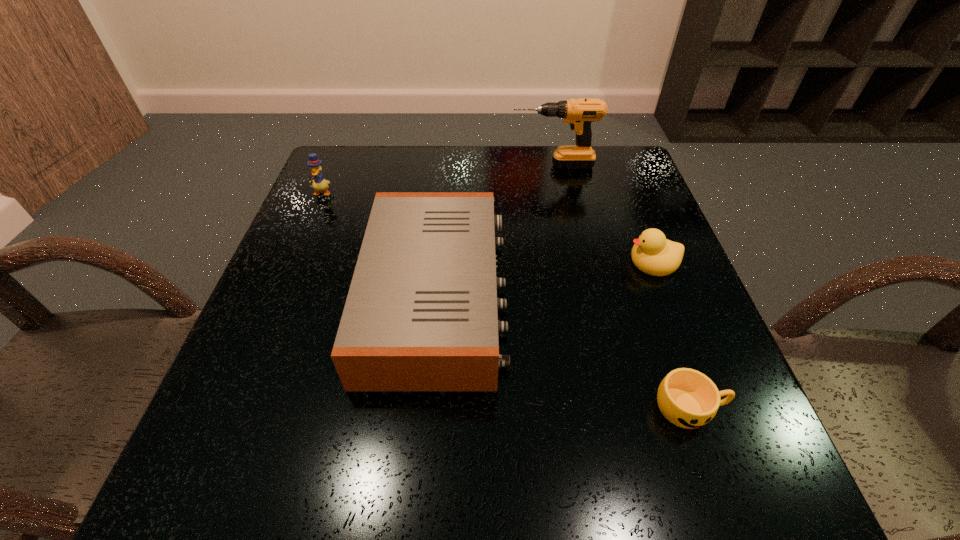
Locate an element on the screen. The width and height of the screenshot is (960, 540). vacant space located at the tip of the farthest object is located at coordinates (364, 165).

The image size is (960, 540). In order to click on free space located on the face of the second farthest object, where the monocle is placed in this screenshot , I will do `click(280, 290)`.

Where is `vacant region located on the front panel of the fourth object from right to left`? This screenshot has width=960, height=540. vacant region located on the front panel of the fourth object from right to left is located at coordinates (566, 297).

I want to click on free space located on the face of the right duckling, so click(476, 261).

The width and height of the screenshot is (960, 540). What are the coordinates of `vacant area situated on the face of the right duckling` in the screenshot? It's located at (443, 261).

At what (x,y) coordinates should I click in order to perform the action: click on free space located on the face of the right duckling. Please return your answer as a coordinate pair (x, y). The image size is (960, 540). Looking at the image, I should click on (589, 261).

Find the location of a particular element. vacant space located 0.050m on the back of the shortest object is located at coordinates (672, 358).

This screenshot has width=960, height=540. Find the location of `drill positioned at the far edge`. drill positioned at the far edge is located at coordinates (579, 113).

Identify the location of duckling that is at the far edge. (319, 183).

At what (x,y) coordinates should I click in order to perform the action: click on object at the left edge. Please return your answer as a coordinate pair (x, y). Image resolution: width=960 pixels, height=540 pixels. Looking at the image, I should click on (319, 183).